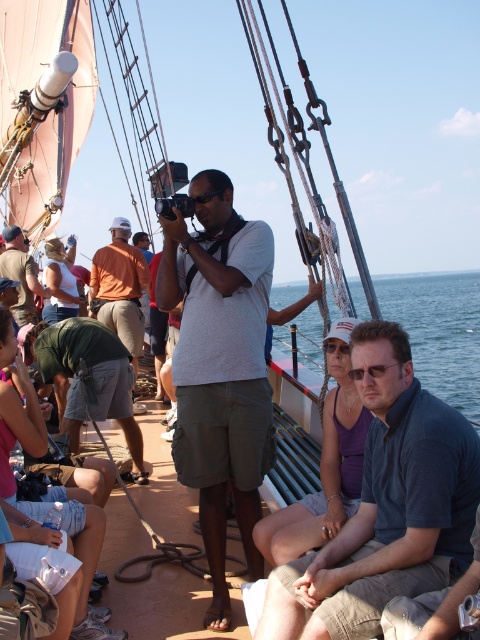
Question: Which object appears closest to the camera in this image?

Choices:
 (A) orange cotton shirt at center
 (B) matte gray shirt at center

Answer: (B)

Question: Can you confirm if dark gray shirt at center is smaller than blue water at lower right?

Choices:
 (A) no
 (B) yes

Answer: (B)

Question: Which object is positioned farthest from the blue water at lower right?

Choices:
 (A) dark gray shirt at center
 (B) matte gray shirt at center
 (C) green cotton shorts at lower left

Answer: (B)

Question: Is dark gray shirt at center wider than matte black camera at center?

Choices:
 (A) no
 (B) yes

Answer: (B)

Question: Can you confirm if matte gray shirt at center is positioned to the left of matte black camera at center?

Choices:
 (A) no
 (B) yes

Answer: (A)

Question: Estimate the real-world distances between objects in this image. Which object is closer to the dark gray shirt at center?

Choices:
 (A) matte black camera at center
 (B) matte gray shirt at center
 (C) blue water at lower right
 (D) green cotton shorts at lower left

Answer: (B)